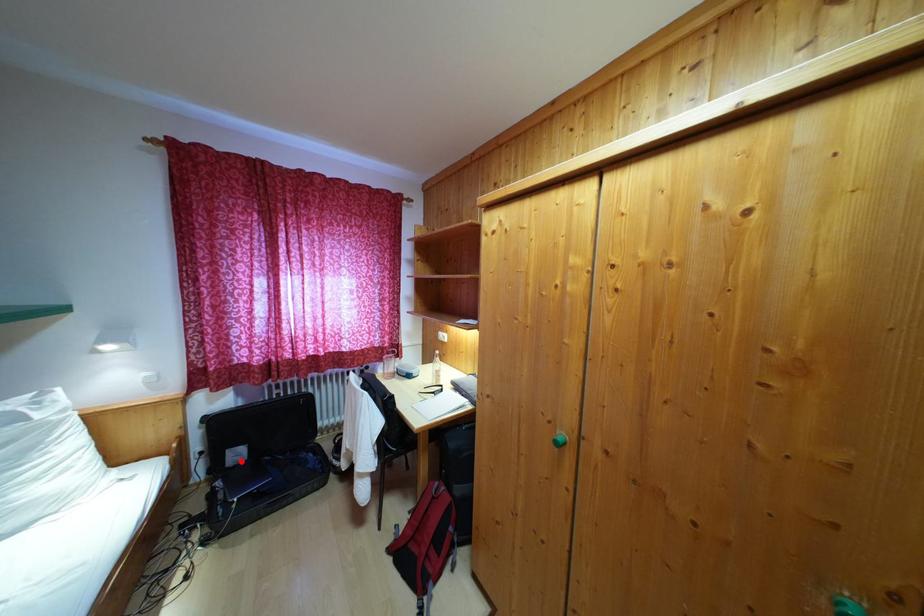
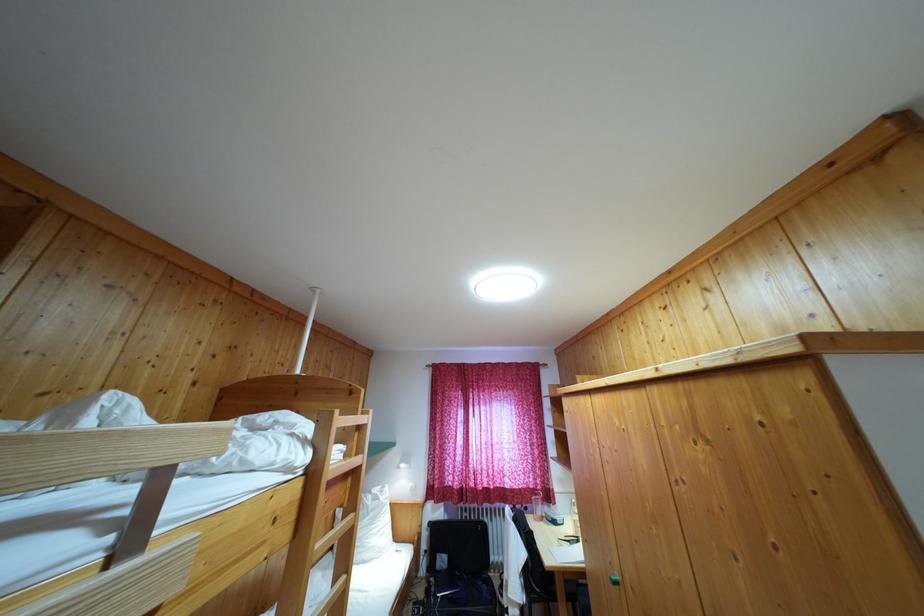
Question: I am providing you with two images of the same scene from different viewpoints. Image1 has a red point marked. In image2, the corresponding 3D location appears at what relative position? Reply with the corresponding letter.

Choices:
 (A) Closer
 (B) Farther

Answer: (A)